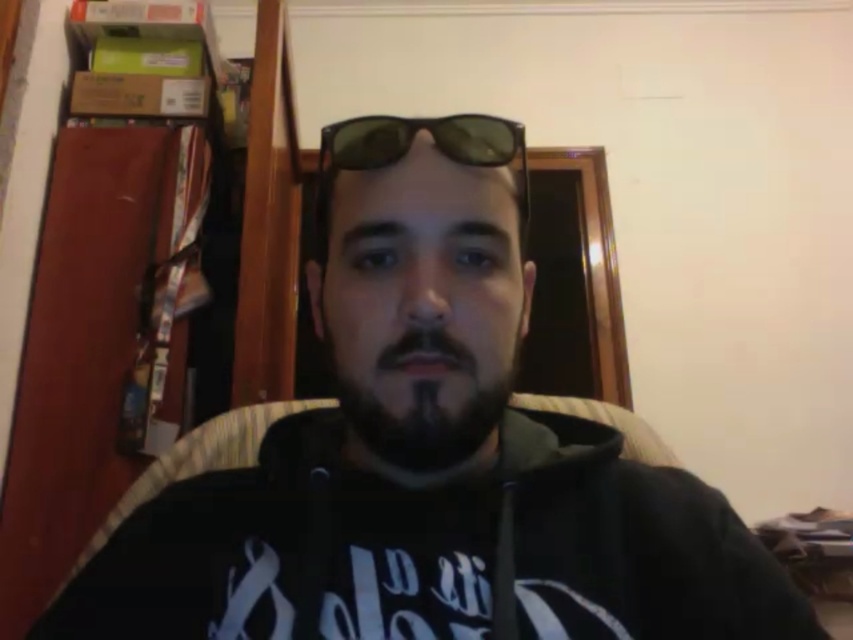
Question: Does dark brown beard at center appear on the left side of black matte sunglasses at center?

Choices:
 (A) yes
 (B) no

Answer: (A)

Question: Can you confirm if dark brown beard at center is thinner than black matte sunglasses at center?

Choices:
 (A) no
 (B) yes

Answer: (B)

Question: Does dark brown beard at center appear under black matte sunglasses at center?

Choices:
 (A) yes
 (B) no

Answer: (A)

Question: Which object is closer to the camera taking this photo?

Choices:
 (A) black matte sunglasses at center
 (B) dark brown beard at center

Answer: (B)

Question: Which object appears farthest from the camera in this image?

Choices:
 (A) dark brown beard at center
 (B) black matte sunglasses at center

Answer: (B)

Question: Which of the following is the closest to the observer?

Choices:
 (A) black matte sunglasses at center
 (B) dark brown beard at center

Answer: (B)